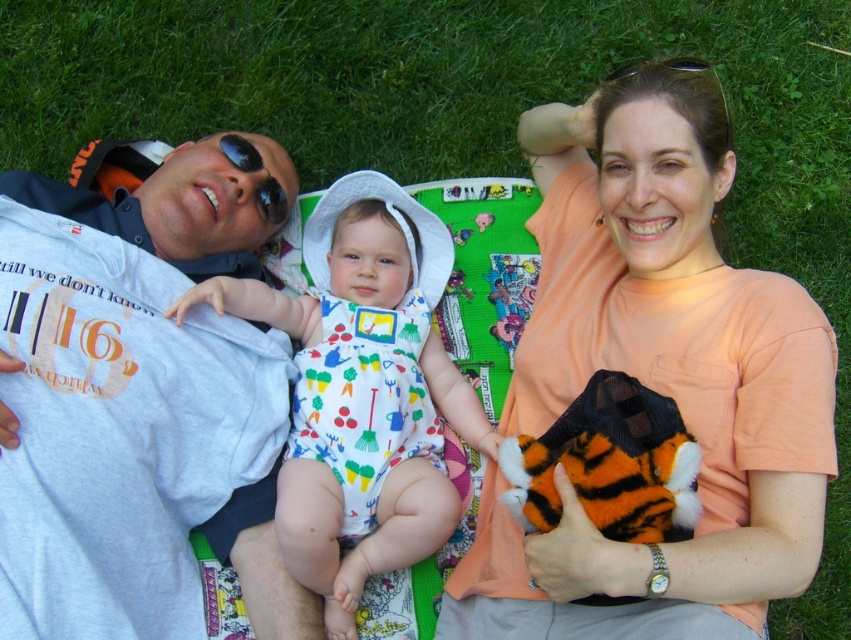
You are a photographer setting up for a family portrait. The orange cotton shirt at upper right and the printed cotton onesie at center are part of the scene. How far apart are these two clothing items in inches?

The orange cotton shirt at upper right is 12.52 inches from the printed cotton onesie at center.